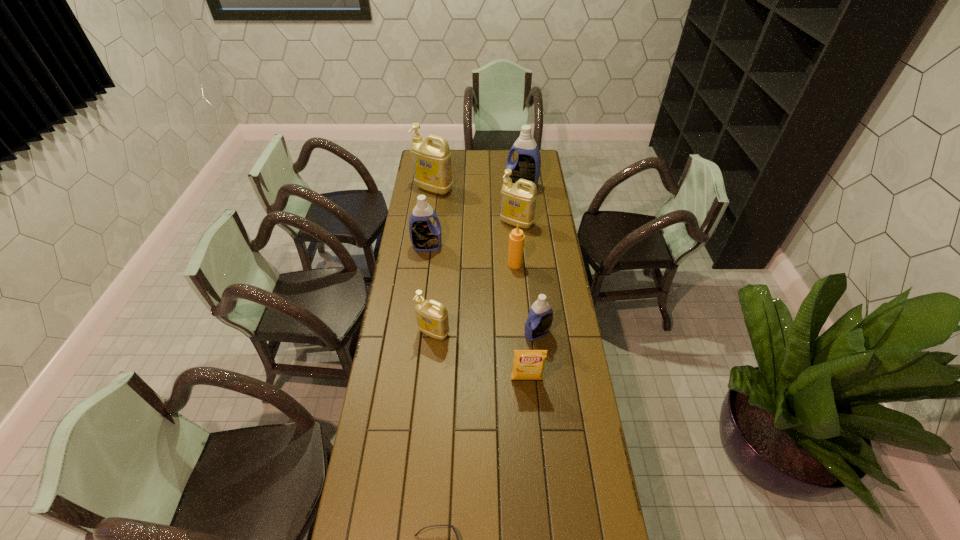
The height and width of the screenshot is (540, 960). I want to click on the eighth tallest object, so click(528, 364).

The width and height of the screenshot is (960, 540). I want to click on the second nearest object, so click(x=528, y=364).

The height and width of the screenshot is (540, 960). I want to click on free spot located 0.270m on the front of the farthest beige detergent, so click(x=429, y=229).

Where is `free spot located on the front of the biggest blue detergent`? The image size is (960, 540). free spot located on the front of the biggest blue detergent is located at coordinates (526, 226).

Where is `free space located 0.110m on the front of the fourth nearest detergent`? The image size is (960, 540). free space located 0.110m on the front of the fourth nearest detergent is located at coordinates (519, 246).

The height and width of the screenshot is (540, 960). Identify the location of free space located on the front of the leftmost blue detergent. point(424,270).

The width and height of the screenshot is (960, 540). I want to click on vacant area situated on the left of the condiment, so click(x=448, y=264).

You are a GUI agent. You are given a task and a screenshot of the screen. Output one action in this format:
    pyautogui.click(x=<x>, y=<y>)
    Task: Click on the free space located 0.260m on the front of the nearest beige detergent
    Image resolution: width=960 pixels, height=540 pixels.
    Given the screenshot: What is the action you would take?
    pyautogui.click(x=428, y=402)

Identify the location of free space located 0.060m on the right of the smallest blue detergent. The image size is (960, 540). (565, 333).

Identify the location of vacant space located 0.200m on the front of the eighth farthest object with the logo. (532, 436).